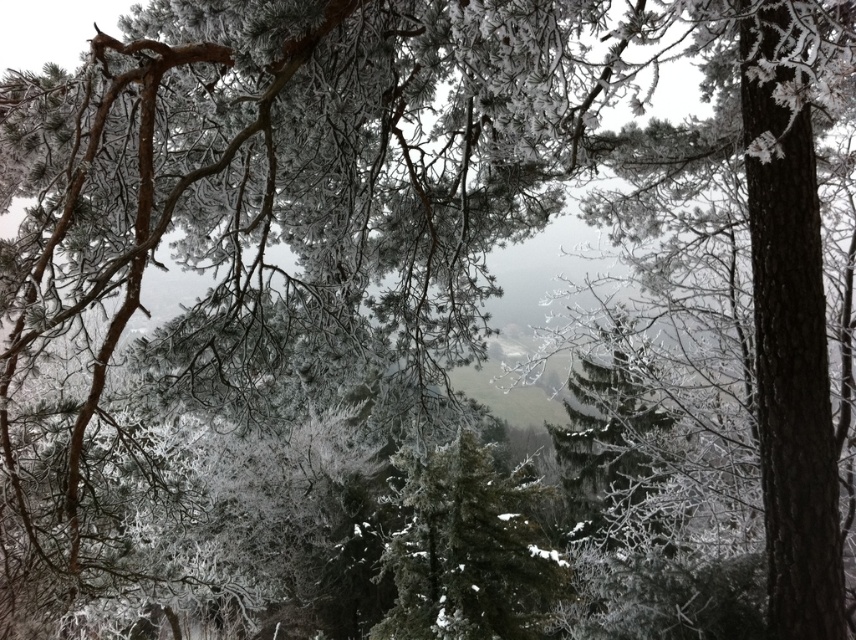
You are standing in the winter forest and notice two trees at the center of your view. Which tree is positioned lower in your field of view, the green matte tree at center or the frosted pine tree at center?

The green matte tree at center is located below the frosted pine tree at center, so it is positioned lower in your field of view.

You are an artist painting this winter scene. You have two trees in the center, a green matte tree at center and a frosted pine tree at center. Which tree should you paint smaller to maintain the perspective shown in the image?

You should paint the green matte tree at center smaller because it occupies less space than the frosted pine tree at center according to the description.

You are standing in the winter forest scene. There is a green matte tree at center. Can you see the point at coordinates (467, 550)? If yes, what object is located there?

The point at coordinates (467, 550) indicates the green matte tree at center.